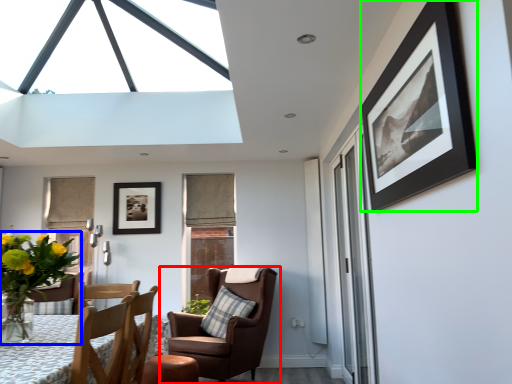
Question: Based on their relative distances, which object is nearer to chair (highlighted by a red box)? Choose from houseplant (highlighted by a blue box) and picture frame (highlighted by a green box).

Choices:
 (A) houseplant
 (B) picture frame

Answer: (A)